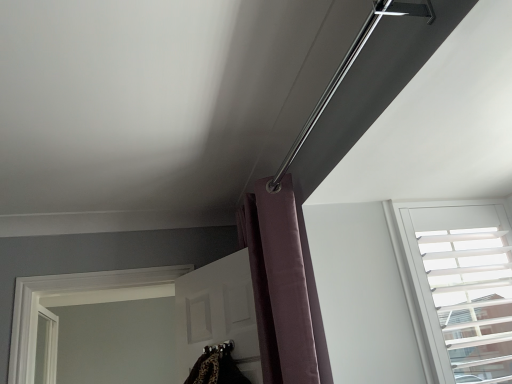
Question: From a real-world perspective, is white textured blinds at upper right positioned over purple velvet curtain at upper center based on gravity?

Choices:
 (A) no
 (B) yes

Answer: (A)

Question: Can you confirm if white textured blinds at upper right is thinner than purple velvet curtain at upper center?

Choices:
 (A) yes
 (B) no

Answer: (A)

Question: Considering the relative sizes of white textured blinds at upper right and purple velvet curtain at upper center in the image provided, is white textured blinds at upper right shorter than purple velvet curtain at upper center?

Choices:
 (A) yes
 (B) no

Answer: (A)

Question: From the image's perspective, is white textured blinds at upper right located above purple velvet curtain at upper center?

Choices:
 (A) yes
 (B) no

Answer: (B)

Question: Is white textured blinds at upper right aimed at purple velvet curtain at upper center?

Choices:
 (A) yes
 (B) no

Answer: (B)

Question: Is white textured blinds at upper right wider than purple velvet curtain at upper center?

Choices:
 (A) yes
 (B) no

Answer: (B)

Question: Does purple velvet curtain at upper center have a smaller size compared to white textured blinds at upper right?

Choices:
 (A) no
 (B) yes

Answer: (A)

Question: Is purple velvet curtain at upper center to the right of white textured blinds at upper right from the viewer's perspective?

Choices:
 (A) yes
 (B) no

Answer: (B)

Question: From the image's perspective, is purple velvet curtain at upper center on white textured blinds at upper right?

Choices:
 (A) yes
 (B) no

Answer: (A)

Question: Is purple velvet curtain at upper center taller than white textured blinds at upper right?

Choices:
 (A) no
 (B) yes

Answer: (B)

Question: Is purple velvet curtain at upper center completely or partially outside of white textured blinds at upper right?

Choices:
 (A) yes
 (B) no

Answer: (A)

Question: From the image's perspective, is purple velvet curtain at upper center beneath white textured blinds at upper right?

Choices:
 (A) no
 (B) yes

Answer: (A)

Question: In terms of height, does purple velvet curtain at upper center look taller or shorter compared to white textured blinds at upper right?

Choices:
 (A) short
 (B) tall

Answer: (B)